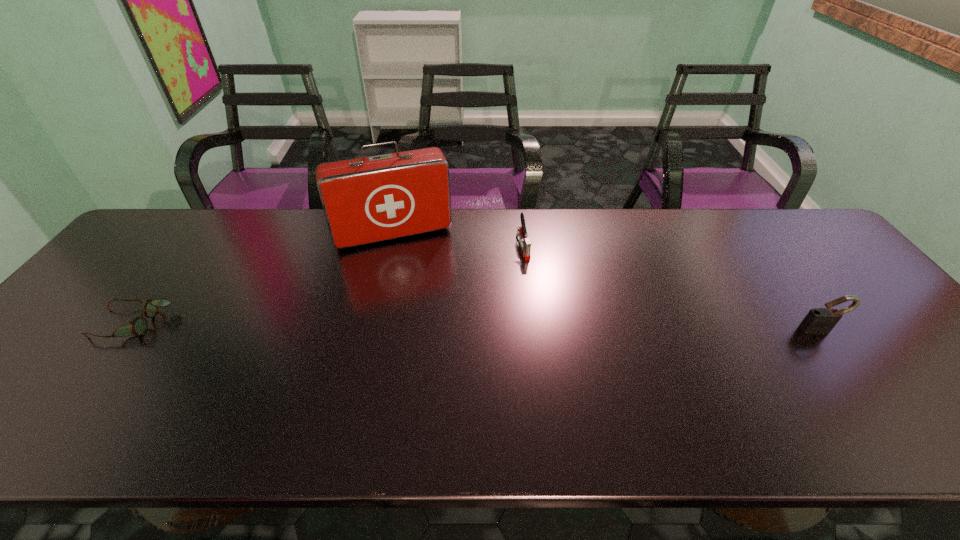
Find the location of a particular element. The width and height of the screenshot is (960, 540). blank area at the far edge is located at coordinates (697, 222).

You are a GUI agent. You are given a task and a screenshot of the screen. Output one action in this format:
    pyautogui.click(x=<x>, y=<y>)
    Task: Click on the blank space at the near edge of the desktop
    
    Given the screenshot: What is the action you would take?
    pyautogui.click(x=320, y=387)

At what (x,y) coordinates should I click in order to perform the action: click on free space at the left edge. Please return your answer as a coordinate pair (x, y). This screenshot has width=960, height=540. Looking at the image, I should click on (127, 258).

Identify the location of vacant space at the far left corner of the desktop. (160, 215).

Find the location of a particular element. This screenshot has width=960, height=540. free space at the far right corner of the desktop is located at coordinates [804, 241].

The width and height of the screenshot is (960, 540). In order to click on free space between the first-aid kit and the stapler in this screenshot , I will do `click(458, 240)`.

I want to click on free spot between the second object from left to right and the rightmost object, so click(x=607, y=282).

Where is `free area in between the padlock and the stapler`? This screenshot has height=540, width=960. free area in between the padlock and the stapler is located at coordinates (671, 288).

Find the location of a particular element. This screenshot has height=540, width=960. free area in between the spectacles and the second tallest object is located at coordinates (476, 327).

I want to click on vacant region between the first-aid kit and the stapler, so click(x=458, y=240).